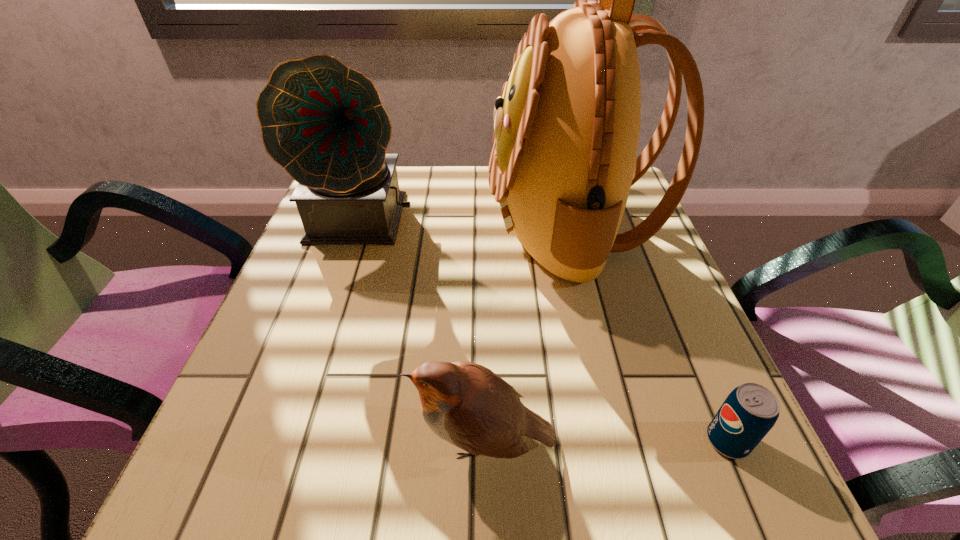
Find the location of `object located at the far left corner`. object located at the far left corner is located at coordinates (323, 122).

This screenshot has width=960, height=540. In order to click on object at the far right corner in this screenshot , I will do `click(566, 130)`.

This screenshot has width=960, height=540. I want to click on object that is positioned at the near right corner, so click(749, 412).

In the image, there is a desktop. In order to click on free region at the far edge in this screenshot , I will do `click(472, 190)`.

Locate an element on the screen. The height and width of the screenshot is (540, 960). vacant region at the near edge of the desktop is located at coordinates (355, 472).

Where is `free space at the left edge`? The width and height of the screenshot is (960, 540). free space at the left edge is located at coordinates (344, 297).

Where is `free space at the right edge of the desktop`? free space at the right edge of the desktop is located at coordinates (661, 249).

The height and width of the screenshot is (540, 960). I want to click on free region at the near left corner of the desktop, so click(199, 498).

Find the location of a particular element. free spot between the backpack and the shortest object is located at coordinates click(x=649, y=333).

The height and width of the screenshot is (540, 960). Find the location of `unoccupied area between the third tallest object and the backpack`. unoccupied area between the third tallest object and the backpack is located at coordinates (527, 333).